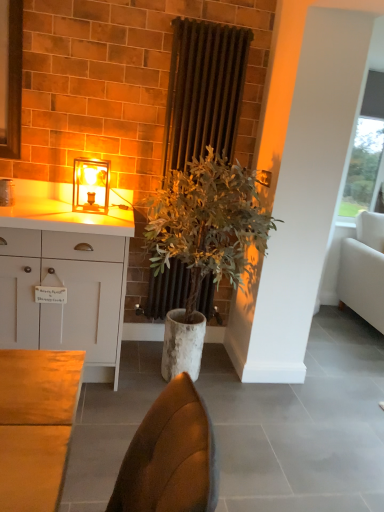
Question: From the image's perspective, does white fabric couch at right appear higher than white matte cabinet at left?

Choices:
 (A) no
 (B) yes

Answer: (B)

Question: Does white fabric couch at right have a greater height compared to white matte cabinet at left?

Choices:
 (A) no
 (B) yes

Answer: (B)

Question: From the image's perspective, would you say white fabric couch at right is shown under white matte cabinet at left?

Choices:
 (A) no
 (B) yes

Answer: (A)

Question: Is white fabric couch at right positioned beyond the bounds of white matte cabinet at left?

Choices:
 (A) no
 (B) yes

Answer: (B)

Question: From a real-world perspective, is white fabric couch at right over white matte cabinet at left?

Choices:
 (A) yes
 (B) no

Answer: (A)

Question: Considering the positions of matte glass table lamp at upper left and dark brown radiator at center in the image, is matte glass table lamp at upper left bigger or smaller than dark brown radiator at center?

Choices:
 (A) small
 (B) big

Answer: (A)

Question: Considering the positions of matte glass table lamp at upper left and dark brown radiator at center in the image, is matte glass table lamp at upper left wider or thinner than dark brown radiator at center?

Choices:
 (A) thin
 (B) wide

Answer: (B)

Question: Is point (74, 158) closer or farther from the camera than point (195, 117)?

Choices:
 (A) closer
 (B) farther

Answer: (A)

Question: Considering the relative positions of matte glass table lamp at upper left and dark brown radiator at center in the image provided, is matte glass table lamp at upper left to the left or to the right of dark brown radiator at center?

Choices:
 (A) left
 (B) right

Answer: (A)

Question: Is point (170, 269) positioned closer to the camera than point (77, 185)?

Choices:
 (A) closer
 (B) farther

Answer: (B)

Question: Is dark brown radiator at center bigger or smaller than matte glass table lamp at upper left?

Choices:
 (A) big
 (B) small

Answer: (A)

Question: Based on their positions, is dark brown radiator at center located to the left or right of matte glass table lamp at upper left?

Choices:
 (A) right
 (B) left

Answer: (A)

Question: In terms of height, does dark brown radiator at center look taller or shorter compared to matte glass table lamp at upper left?

Choices:
 (A) short
 (B) tall

Answer: (B)

Question: Does point (244, 246) appear closer or farther from the camera than point (76, 166)?

Choices:
 (A) closer
 (B) farther

Answer: (A)

Question: From their relative heights in the image, would you say green leafy plant at center is taller or shorter than matte glass table lamp at upper left?

Choices:
 (A) tall
 (B) short

Answer: (A)